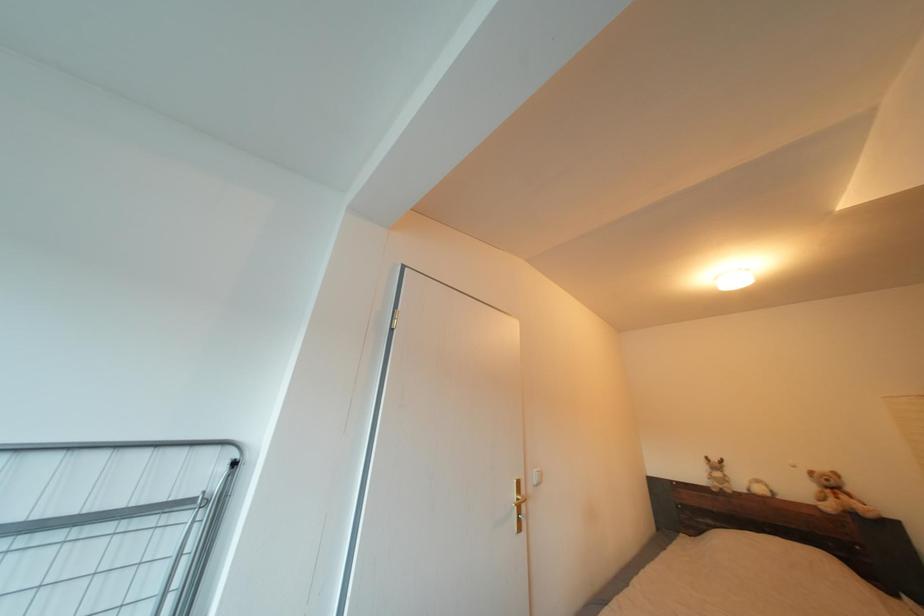
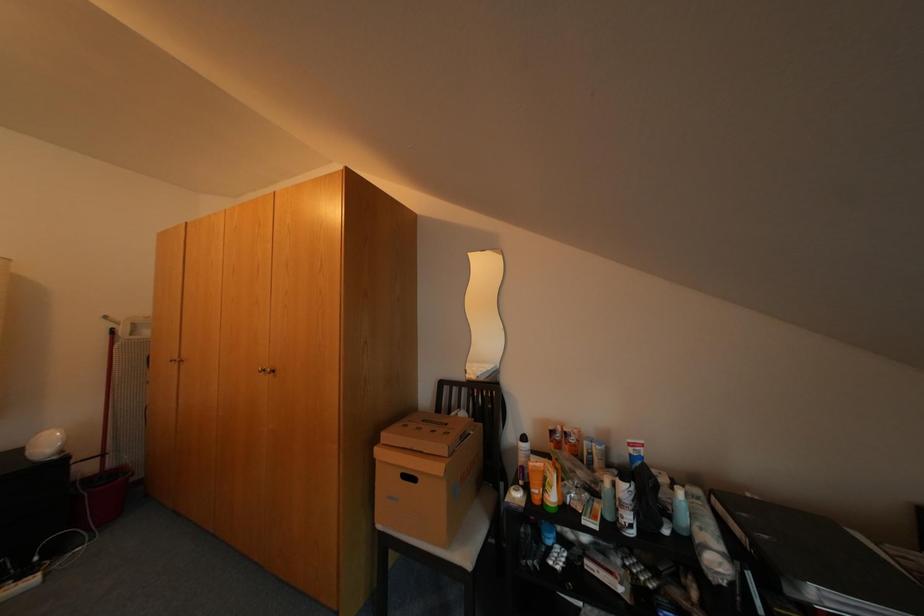
Question: The camera is either moving clockwise (left) or counter-clockwise (right) around the object. The first image is from the beginning of the video and the second image is from the end. Is the camera moving left or right when shooting the video?

Choices:
 (A) Left
 (B) Right

Answer: (A)